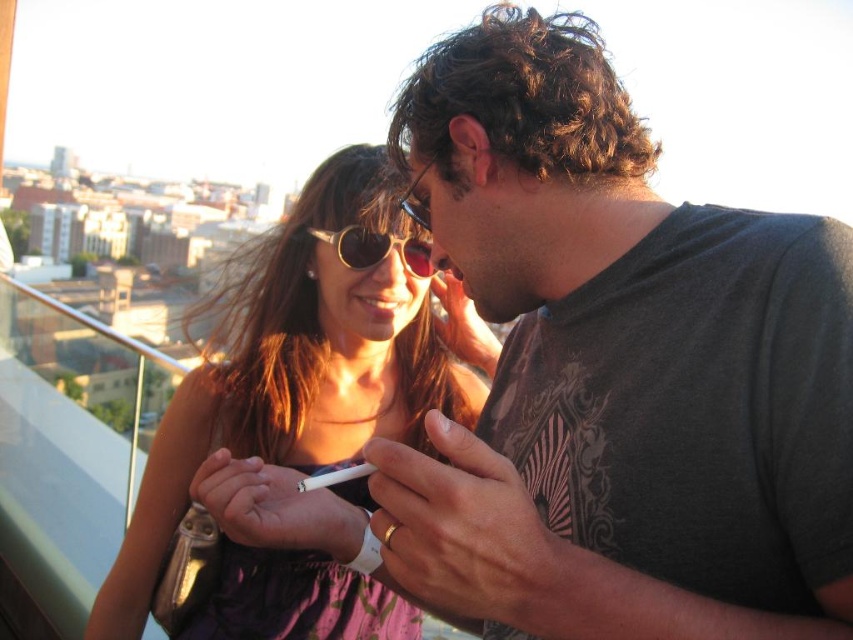
Question: Is dark gray t-shirt at center to the left of matte purple dress at center from the viewer's perspective?

Choices:
 (A) no
 (B) yes

Answer: (A)

Question: Estimate the real-world distances between objects in this image. Which object is farther from the matte purple dress at center?

Choices:
 (A) sunglasses at center
 (B) dark gray t-shirt at center

Answer: (B)

Question: Can you confirm if dark gray t-shirt at center is positioned to the left of matte purple dress at center?

Choices:
 (A) no
 (B) yes

Answer: (A)

Question: Estimate the real-world distances between objects in this image. Which object is farther from the dark gray t-shirt at center?

Choices:
 (A) sunglasses at center
 (B) matte purple dress at center

Answer: (A)

Question: Does matte purple dress at center have a larger size compared to sunglasses at center?

Choices:
 (A) yes
 (B) no

Answer: (A)

Question: Which point appears closest to the camera in this image?

Choices:
 (A) (193, 429)
 (B) (483, 67)

Answer: (B)